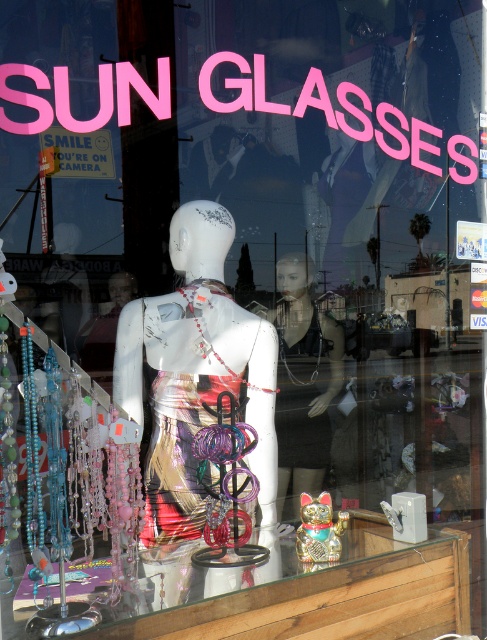
Question: Does white glossy mannequin at center have a smaller size compared to metallic gold cat at center?

Choices:
 (A) yes
 (B) no

Answer: (B)

Question: In this image, where is white glossy mannequin at center located relative to metallic gold cat at center?

Choices:
 (A) right
 (B) left

Answer: (B)

Question: Which object is closer to the camera taking this photo?

Choices:
 (A) white glossy mannequin at center
 (B) metallic gold cat at center

Answer: (A)

Question: Can you confirm if white glossy mannequin at center is positioned below metallic gold cat at center?

Choices:
 (A) no
 (B) yes

Answer: (A)

Question: Which of the following is the closest to the observer?

Choices:
 (A) white glossy mannequin at center
 (B) metallic gold cat at center

Answer: (A)

Question: Which object appears closest to the camera in this image?

Choices:
 (A) metallic gold cat at center
 (B) white glossy mannequin at center

Answer: (B)